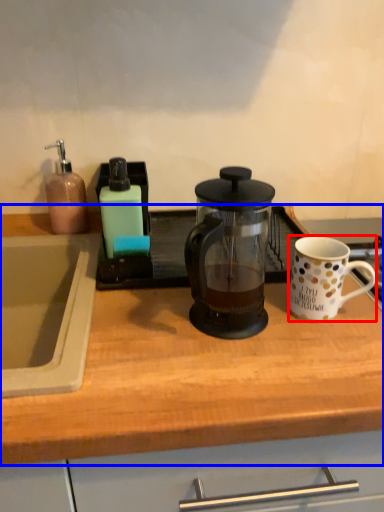
Question: Among these objects, which one is farthest to the camera, coffee cup (highlighted by a red box) or countertop (highlighted by a blue box)?

Choices:
 (A) coffee cup
 (B) countertop

Answer: (A)